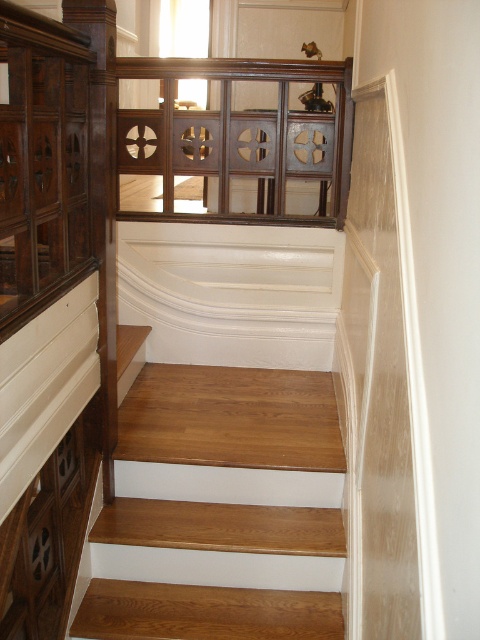
From the picture: Is wooden stairs at center bigger than dark wood paneling at upper center?

Indeed, wooden stairs at center has a larger size compared to dark wood paneling at upper center.

Can you confirm if wooden stairs at center is taller than dark wood paneling at upper center?

Correct, wooden stairs at center is much taller as dark wood paneling at upper center.

Is point (200, 598) behind point (228, 104)?

No.

The height and width of the screenshot is (640, 480). Identify the location of wooden stairs at center. (226, 460).